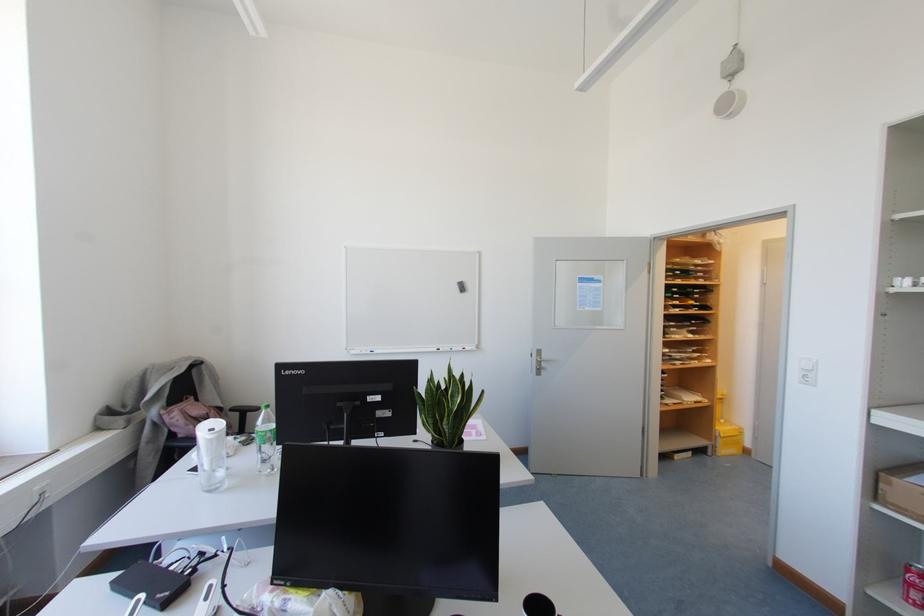
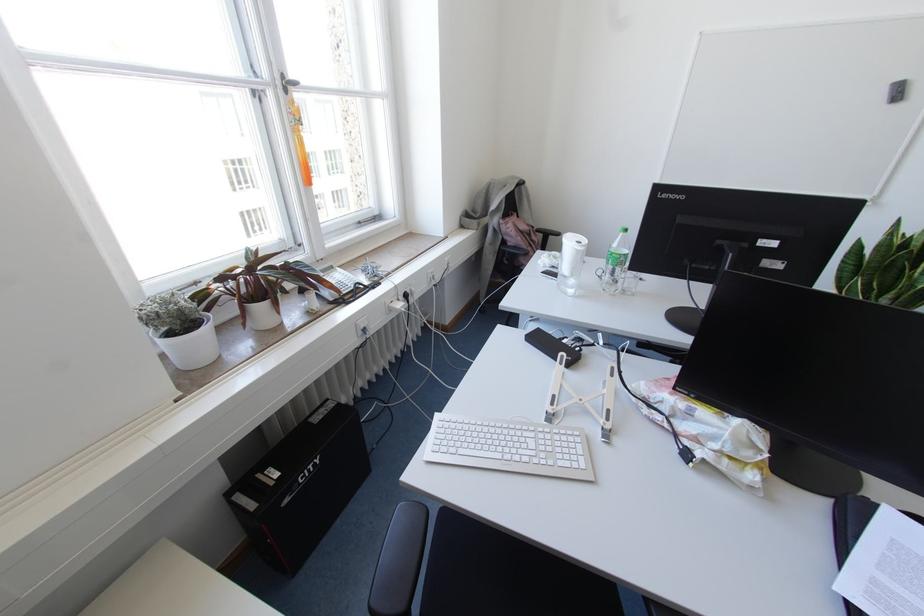
The point at (x=266, y=406) is marked in the first image. Where is the corresponding point in the second image?

(625, 229)